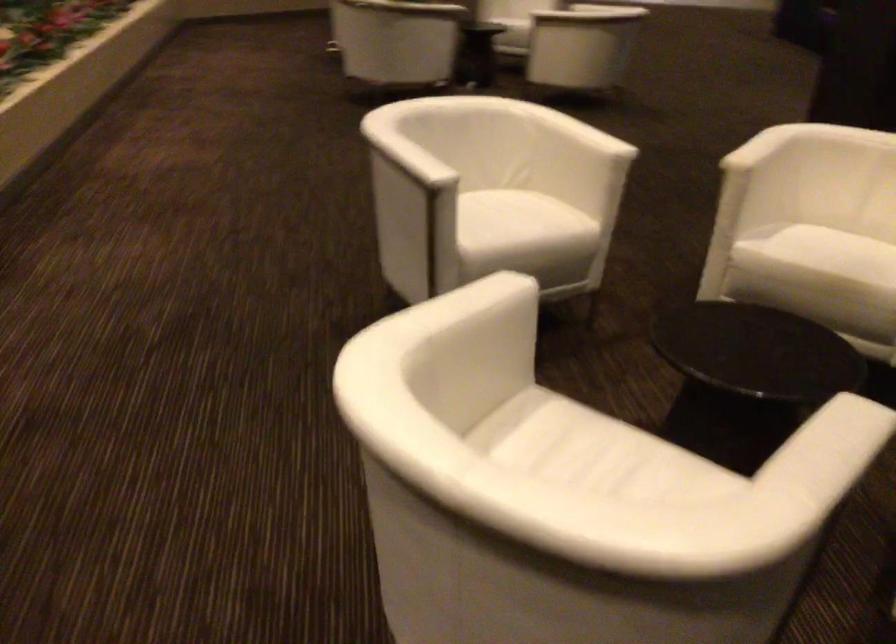
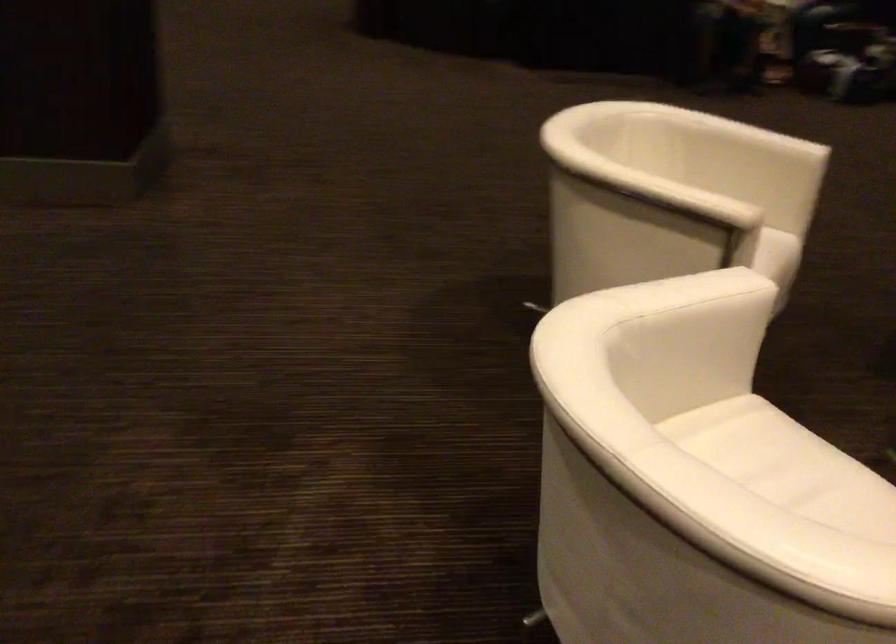
Where in the second image is the point corresponding to (x=753, y=146) from the first image?

(675, 194)